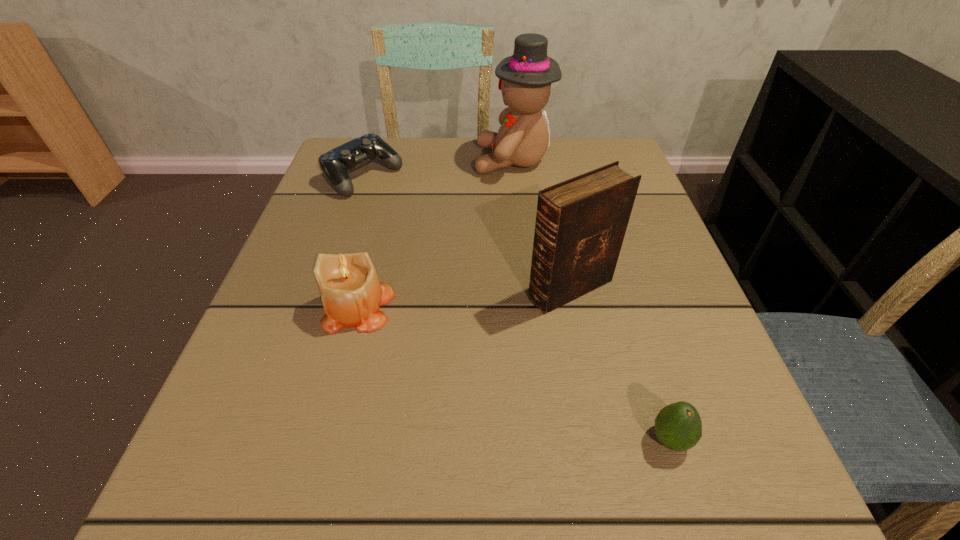
Image resolution: width=960 pixels, height=540 pixels. In order to click on free space between the third tallest object and the tallest object in this screenshot , I will do `click(437, 234)`.

Where is `vacant space that is in between the third tallest object and the control`? The image size is (960, 540). vacant space that is in between the third tallest object and the control is located at coordinates (361, 242).

Identify the location of vacant space in between the candle and the nearest object. (515, 373).

You are a GUI agent. You are given a task and a screenshot of the screen. Output one action in this format:
    pyautogui.click(x=<x>, y=<y>)
    Task: Click on the free space between the nearest object and the candle
    Image resolution: width=960 pixels, height=540 pixels.
    Given the screenshot: What is the action you would take?
    pyautogui.click(x=515, y=373)

What are the coordinates of `vacant area between the rag_doll and the candle` in the screenshot? It's located at (437, 234).

Locate an element on the screen. free space between the control and the nearest object is located at coordinates (516, 308).

Identify which object is located as the fourth nearest to the rag_doll. Please provide its 2D coordinates. Your answer should be formatted as a tuple, i.e. [(x, y)], where the tuple contains the x and y coordinates of a point satisfying the conditions above.

[(678, 426)]

Identify which object is the third nearest to the control. Please provide its 2D coordinates. Your answer should be formatted as a tuple, i.e. [(x, y)], where the tuple contains the x and y coordinates of a point satisfying the conditions above.

[(580, 226)]

Where is `blank space that satisfies the following two spatial constraints: 1. on the front side of the avocado; 2. on the right side of the control`? This screenshot has height=540, width=960. blank space that satisfies the following two spatial constraints: 1. on the front side of the avocado; 2. on the right side of the control is located at coordinates [273, 440].

You are a GUI agent. You are given a task and a screenshot of the screen. Output one action in this format:
    pyautogui.click(x=<x>, y=<y>)
    Task: Click on the blank space that satisfies the following two spatial constraints: 1. on the back side of the second tallest object; 2. on the left side of the third shortest object
    This screenshot has height=540, width=960.
    Given the screenshot: What is the action you would take?
    pyautogui.click(x=365, y=289)